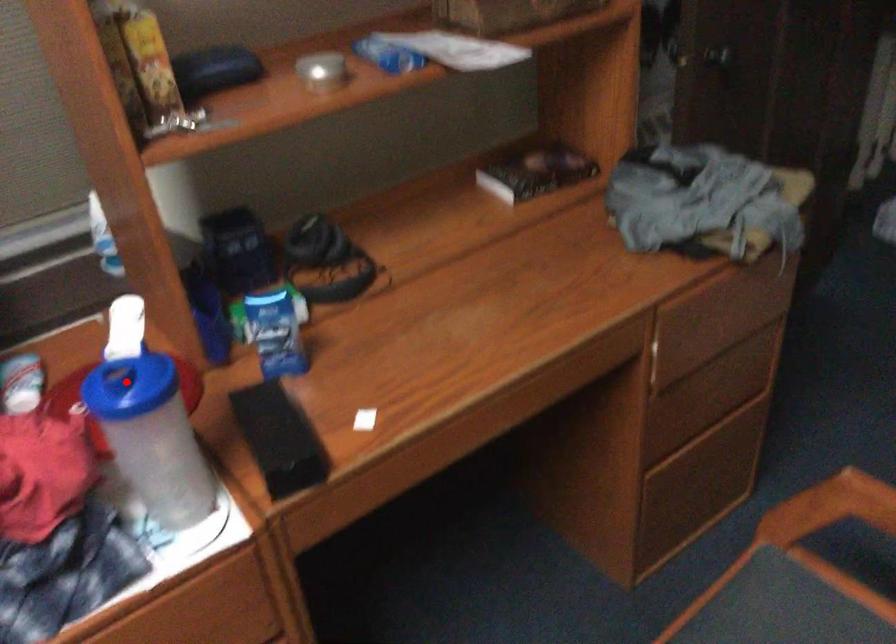
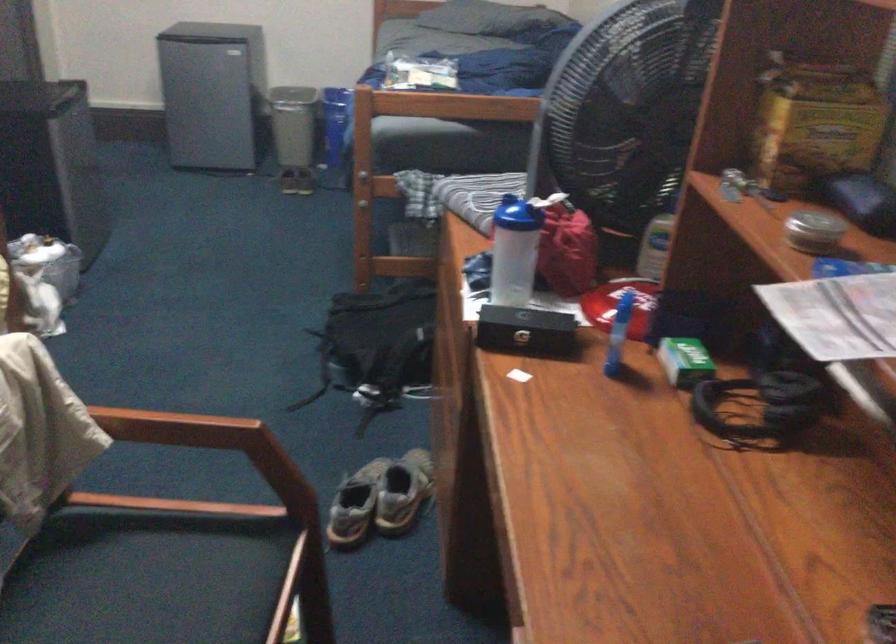
In the second image, find the point that corresponds to the highlighted location in the first image.

(510, 214)